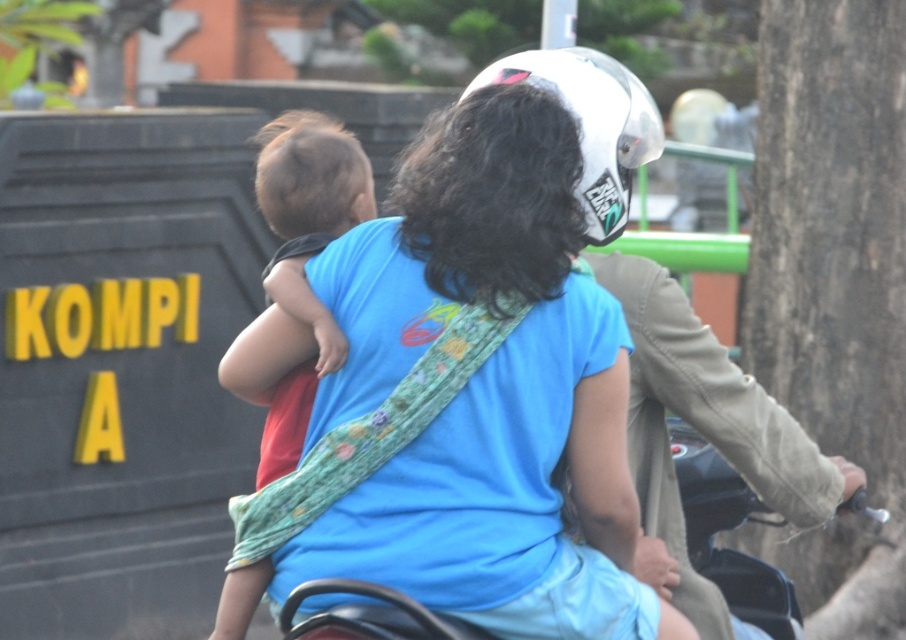
Can you confirm if black matte motorcycle at center is smaller than green leafy tree at upper center?

Correct, black matte motorcycle at center occupies less space than green leafy tree at upper center.

Is black matte motorcycle at center to the right of green leafy tree at upper center from the viewer's perspective?

Correct, you'll find black matte motorcycle at center to the right of green leafy tree at upper center.

Is point (355, 614) in front of point (392, 49)?

Yes, point (355, 614) is in front of point (392, 49).

Where is `black matte motorcycle at center`? black matte motorcycle at center is located at coordinates (728, 529).

Which is in front, point (571, 604) or point (822, 342)?

Point (571, 604)

Between blue fabric shirt at center and smooth bark tree at right, which one is positioned higher?

Positioned higher is smooth bark tree at right.

Measure the distance between blue fabric shirt at center and camera.

blue fabric shirt at center and camera are 4.37 meters apart from each other.

Where is `blue fabric shirt at center`? blue fabric shirt at center is located at coordinates click(x=487, y=388).

Is smooth bark tree at right thinner than light brown hair at upper left?

Incorrect, smooth bark tree at right's width is not less than light brown hair at upper left's.

The image size is (906, 640). I want to click on smooth bark tree at right, so click(x=834, y=284).

Find the location of a particular element. The width and height of the screenshot is (906, 640). smooth bark tree at right is located at coordinates (834, 284).